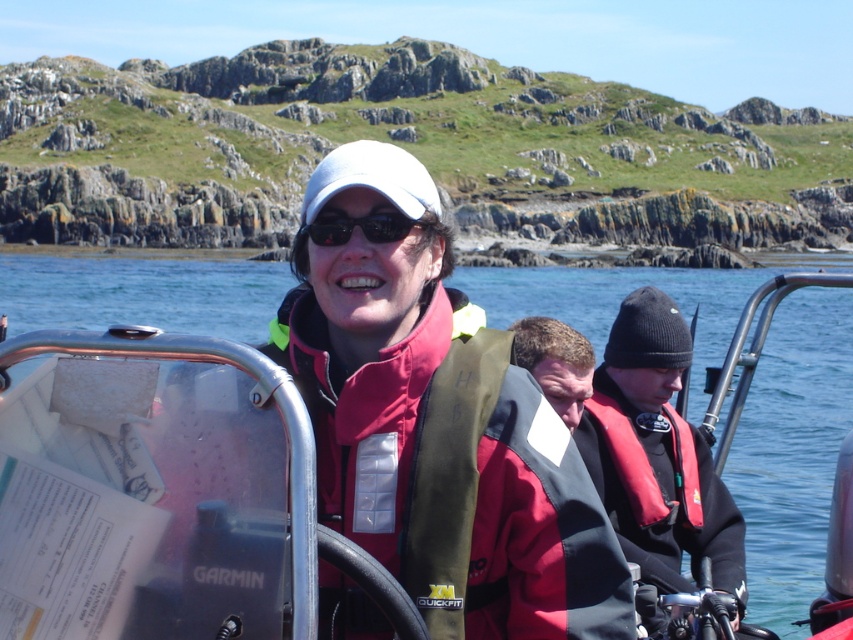
Does red matte life jacket at right appear on the left side of dark brown hair at center?

In fact, red matte life jacket at right is to the right of dark brown hair at center.

Describe the element at coordinates (630, 460) in the screenshot. I see `red matte life jacket at right` at that location.

Is point (616, 435) positioned behind point (547, 352)?

No, it is in front of (547, 352).

Identify the location of red matte life jacket at right. point(630,460).

Does dark brown hair at center appear over black matte sunglasses at center?

No.

Between dark brown hair at center and black matte sunglasses at center, which one is positioned lower?

dark brown hair at center is below.

Identify the location of dark brown hair at center. (555, 364).

The height and width of the screenshot is (640, 853). In order to click on dark brown hair at center in this screenshot , I will do `click(555, 364)`.

Can you confirm if red matte life jacket at right is wider than black matte sunglasses at center?

In fact, red matte life jacket at right might be narrower than black matte sunglasses at center.

Is red matte life jacket at right in front of black matte sunglasses at center?

No, red matte life jacket at right is behind black matte sunglasses at center.

Between point (625, 419) and point (409, 228), which one is positioned behind?

The point (625, 419) is behind.

This screenshot has height=640, width=853. Identify the location of red matte life jacket at right. (630, 460).